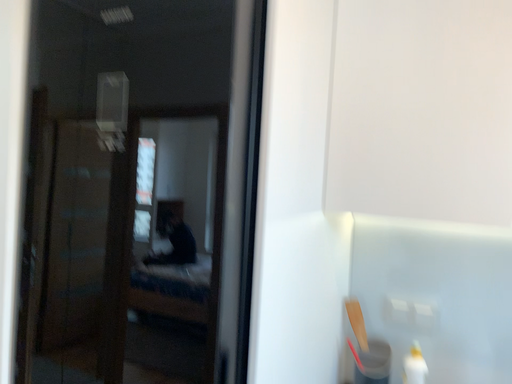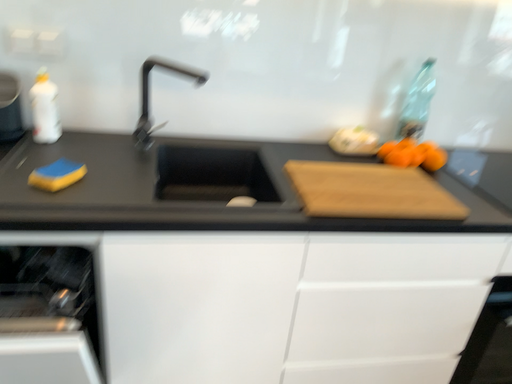
Question: Which way did the camera rotate in the video?

Choices:
 (A) rotated left
 (B) rotated right

Answer: (B)